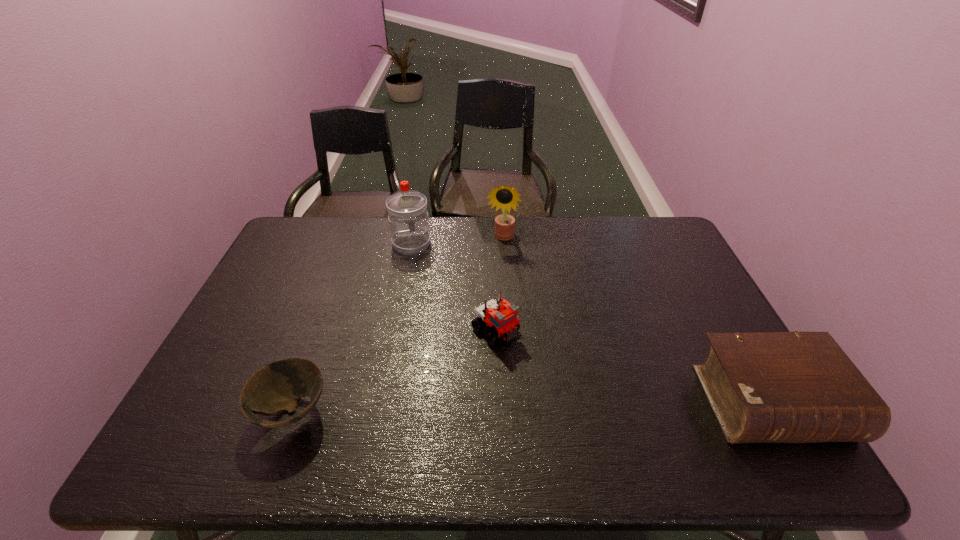
The width and height of the screenshot is (960, 540). I want to click on object located at the left edge, so click(278, 386).

Locate an element on the screen. The height and width of the screenshot is (540, 960). object present at the right edge is located at coordinates (764, 387).

Identify the location of object located in the near left corner section of the desktop. (278, 386).

I want to click on object at the near right corner, so click(x=764, y=387).

Identify the location of vacant region at the far edge. The height and width of the screenshot is (540, 960). (551, 238).

Locate an element on the screen. This screenshot has width=960, height=540. free spot at the near edge of the desktop is located at coordinates (492, 406).

In the image, there is a desktop. In order to click on vacant space at the left edge in this screenshot , I will do `click(275, 264)`.

Where is `vacant space at the right edge of the desktop`? vacant space at the right edge of the desktop is located at coordinates (681, 262).

This screenshot has height=540, width=960. Find the location of `vacant region at the near left corner of the desktop`. vacant region at the near left corner of the desktop is located at coordinates (198, 417).

I want to click on vacant area at the far right corner of the desktop, so click(x=671, y=235).